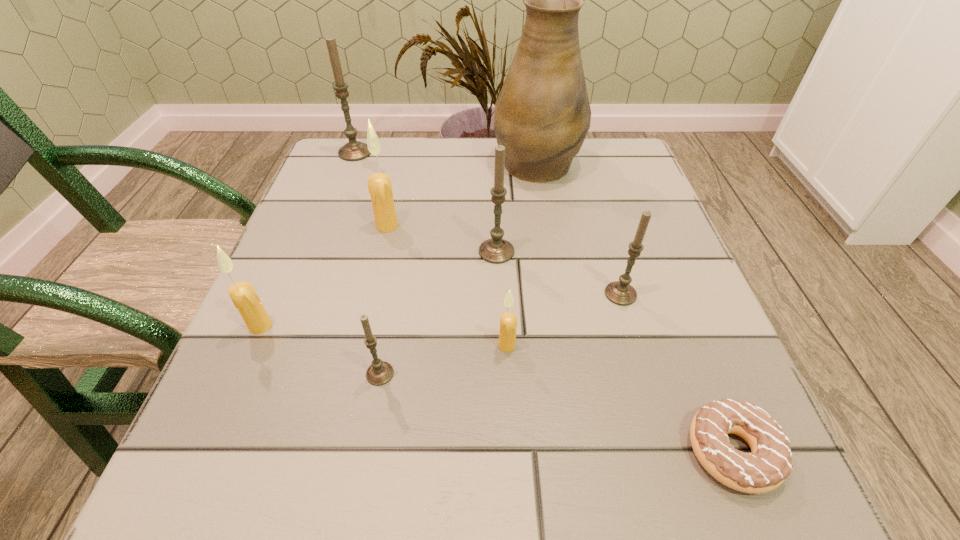
You are a GUI agent. You are given a task and a screenshot of the screen. Output one action in this format:
    pyautogui.click(x=<x>, y=<y>)
    Task: Click on the free space that satisfies the following two spatial constraints: 1. on the front side of the doughnut; 2. on the left side of the third nearest object
    The width and height of the screenshot is (960, 540).
    Given the screenshot: What is the action you would take?
    pyautogui.click(x=513, y=451)

In order to click on vacant area in the image that satisfies the following two spatial constraints: 1. on the back side of the sixth farthest object; 2. on the left side of the third biggest gray candle in this screenshot , I will do `click(275, 294)`.

Identify the location of vacant area that satisfies the following two spatial constraints: 1. on the front side of the second cream candle from right to left; 2. on the left side of the nearest cream candle. This screenshot has height=540, width=960. (360, 345).